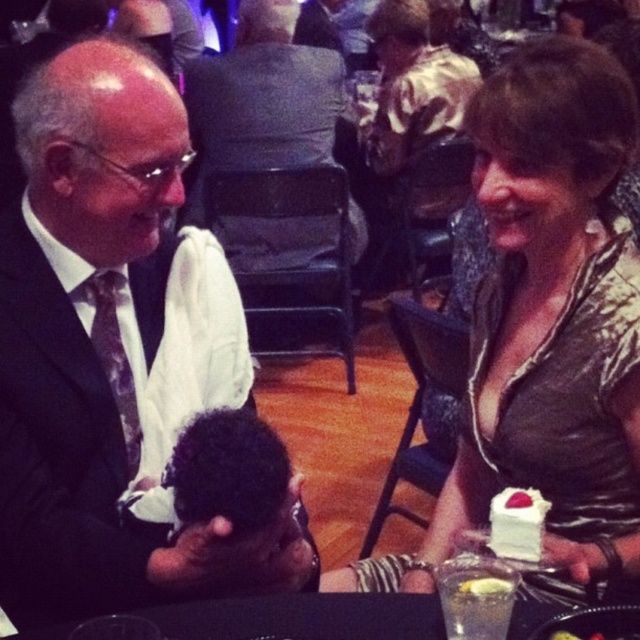
Between point (284, 499) and point (518, 516), which one is positioned in front?

Positioned in front is point (284, 499).

Does black suit at left have a smaller size compared to white creamy cake at lower right?

No, black suit at left is not smaller than white creamy cake at lower right.

What do you see at coordinates (106, 348) in the screenshot? The width and height of the screenshot is (640, 640). I see `black suit at left` at bounding box center [106, 348].

Where is `black suit at left`? black suit at left is located at coordinates (106, 348).

Is dark curly hair at center smaller than white cream cake at right?

Actually, dark curly hair at center might be larger than white cream cake at right.

Between point (244, 413) and point (564, 634), which one is positioned in front?

Positioned in front is point (564, 634).

Based on the photo, who is more distant from viewer, (250,460) or (548,636)?

The point (250,460) is behind.

You are a GUI agent. You are given a task and a screenshot of the screen. Output one action in this format:
    pyautogui.click(x=<x>, y=<y>)
    Task: Click on the dark curly hair at center
    The width and height of the screenshot is (640, 640).
    Given the screenshot: What is the action you would take?
    pyautogui.click(x=234, y=509)

Is dark curly hair at center above white creamy cake at lower right?

Yes, dark curly hair at center is above white creamy cake at lower right.

Is point (275, 512) more distant than point (522, 522)?

No, it is in front of (522, 522).

Does point (268, 493) come farther from viewer compared to point (513, 552)?

No, it is in front of (513, 552).

You are a GUI agent. You are given a task and a screenshot of the screen. Output one action in this format:
    pyautogui.click(x=<x>, y=<y>)
    Task: Click on the dark curly hair at center
    This screenshot has width=640, height=640.
    Given the screenshot: What is the action you would take?
    (234, 509)